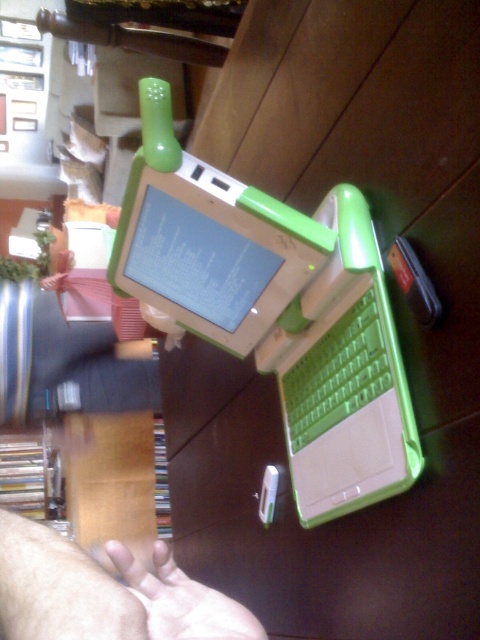
You are trying to place the green plastic laptop at center into a storage box that can only fit items narrower than the skinny white hand at lower left. Can the laptop fit?

The green plastic laptop at center might be wider than the skinny white hand at lower left, so it may not fit in the storage box.

You are trying to locate the green plastic laptop at center in an image. What are the coordinates of its position?

The green plastic laptop at center is located at coordinates point (213, 252).